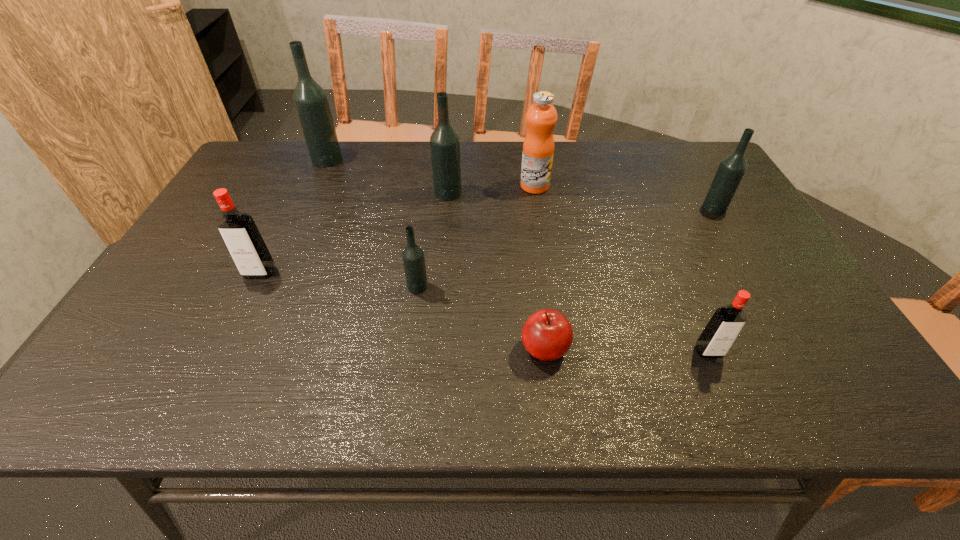
Find the location of a particular element. free point located on the left of the apple is located at coordinates (401, 349).

This screenshot has height=540, width=960. I want to click on vodka located in the far edge section of the desktop, so click(311, 102).

Identify the location of fruit juice positioned at the far edge. Image resolution: width=960 pixels, height=540 pixels. (538, 148).

I want to click on object located in the right edge section of the desktop, so click(x=731, y=170).

Find the location of a particular element. vacant space at the far edge of the desktop is located at coordinates (658, 160).

In the image, there is a desktop. Where is `vacant space at the near edge`? This screenshot has width=960, height=540. vacant space at the near edge is located at coordinates (707, 375).

Identify the location of vacant space at the left edge of the desktop. The image size is (960, 540). (217, 284).

Find the location of a particular element. Image resolution: width=960 pixels, height=540 pixels. unoccupied position between the farthest black vodka and the farther red vodka is located at coordinates (294, 216).

In order to click on free space that is in between the tallest vodka and the second tallest vodka in this screenshot , I will do coord(388,176).

Find the location of a particular element. The height and width of the screenshot is (540, 960). empty location between the third biggest black vodka and the pink apple is located at coordinates (630, 278).